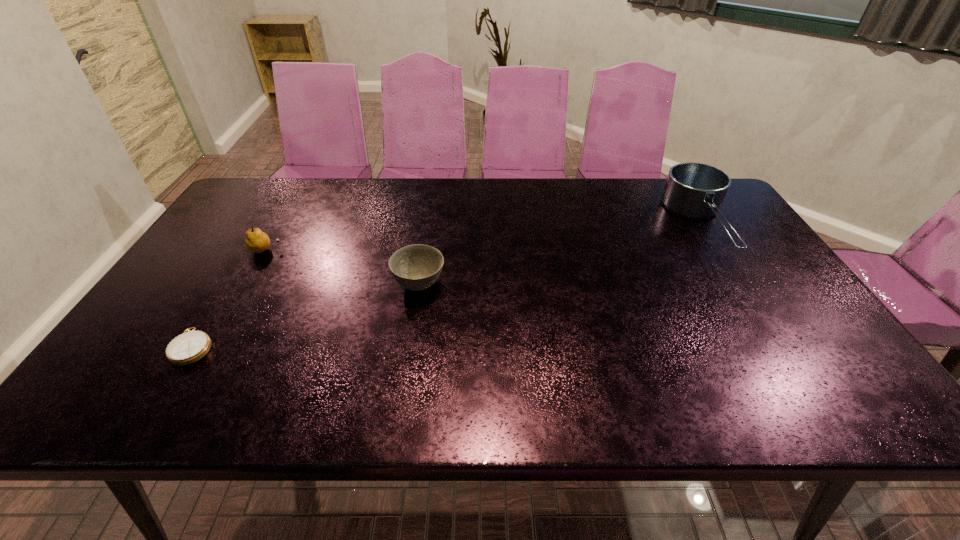
The image size is (960, 540). In order to click on the rightmost object in this screenshot , I will do `click(694, 190)`.

I want to click on saucepan, so click(x=694, y=190).

The height and width of the screenshot is (540, 960). Find the location of `pear`. pear is located at coordinates pyautogui.click(x=257, y=241).

You are a GUI agent. You are given a task and a screenshot of the screen. Output one action in this format:
    pyautogui.click(x=<x>, y=<y>)
    Task: Click on the third object from left to right
    
    Given the screenshot: What is the action you would take?
    pyautogui.click(x=416, y=267)

Locate an element on the screen. The width and height of the screenshot is (960, 540). the shortest object is located at coordinates (189, 347).

Locate an element on the screen. compass is located at coordinates (189, 347).

You are a GUI agent. You are given a task and a screenshot of the screen. Output one action in this format:
    pyautogui.click(x=<x>, y=<y>)
    Task: Click on the free spot located 0.240m with the handle extending from one side of the rightmost object
    The image size is (960, 540).
    Given the screenshot: What is the action you would take?
    pos(776,339)

Locate an element on the screen. The width and height of the screenshot is (960, 540). blank space located 0.100m on the right of the pear is located at coordinates (316, 250).

Identify the location of vacant region located on the back of the bowl. The image size is (960, 540). (428, 221).

Where is `free space located 0.120m on the front of the compass`? The image size is (960, 540). free space located 0.120m on the front of the compass is located at coordinates (151, 415).